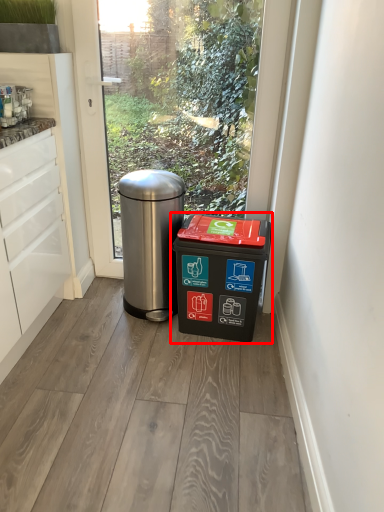
Question: From the image, what is the correct spatial relationship of waste container (annotated by the red box) in relation to waste container?

Choices:
 (A) right
 (B) left

Answer: (A)